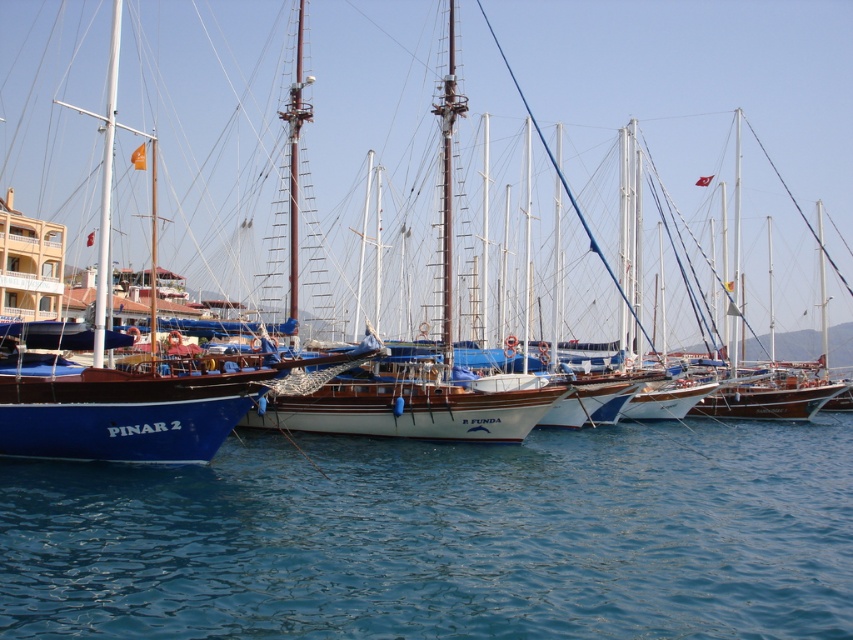
You are a photographer planning to capture the blue polished wood sailboat at left and the blue water at lower left in a single frame. Based on the scene, can you determine if the sailboat is wider than the water area in the photo?

The blue polished wood sailboat at left might be wider than blue water at lower left, so there is a possibility that the sailboat appears wider in the photo.

You are a photographer planning to capture the blue polished wood sailboat at left in a wide shot. Given that your camera has a focal length of 24mm, which is best suited for capturing expansive scenes, will the sailboat be positioned towards the left side of the frame?

The blue polished wood sailboat at left is located at coordinates point (689,93), which places it towards the left side of the frame, so yes, it will be positioned towards the left side of the frame.